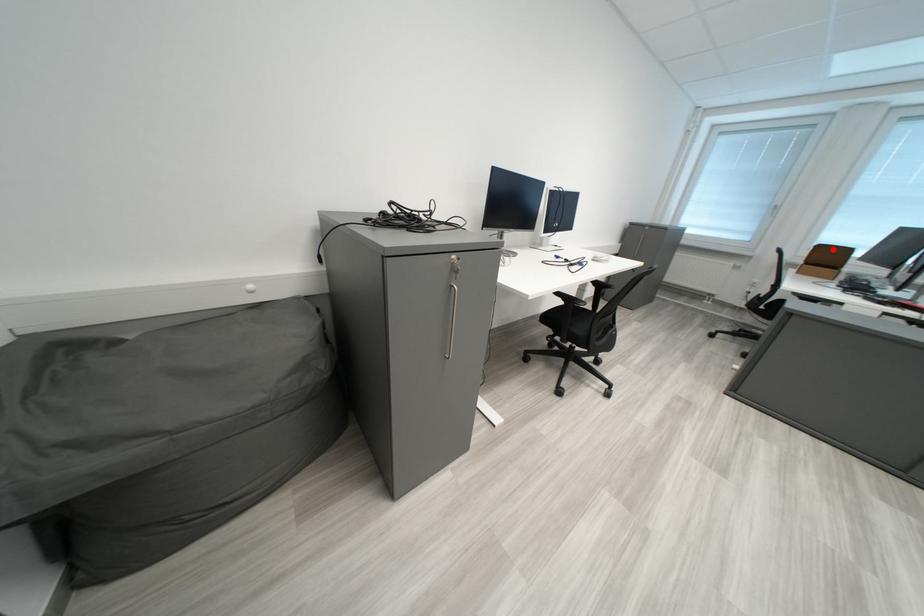
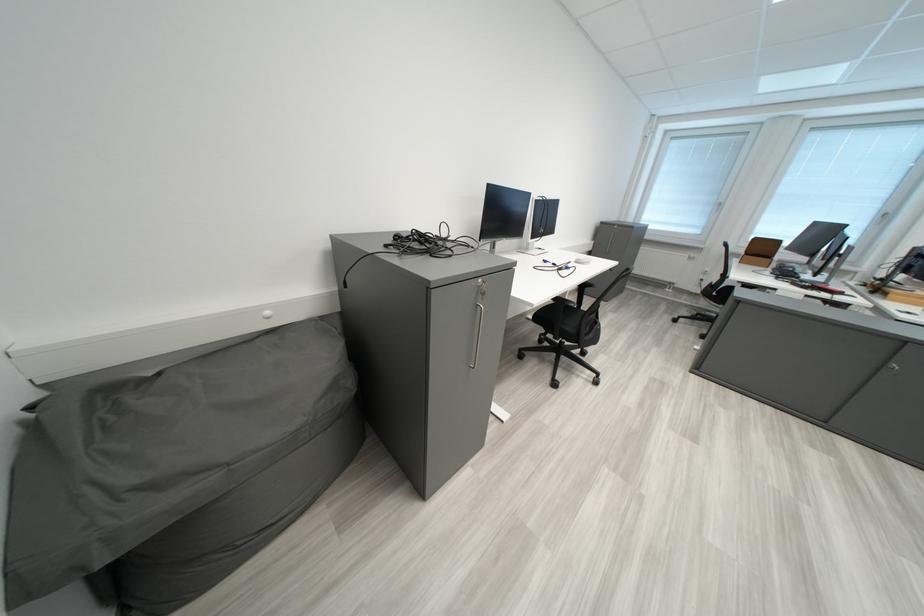
Question: A red point is marked in image1. In image2, is the corresponding 3D point closer to the camera or farther? Reply with the corresponding letter.

Choices:
 (A) The corresponding 3D point is closer.
 (B) The corresponding 3D point is farther.

Answer: (A)